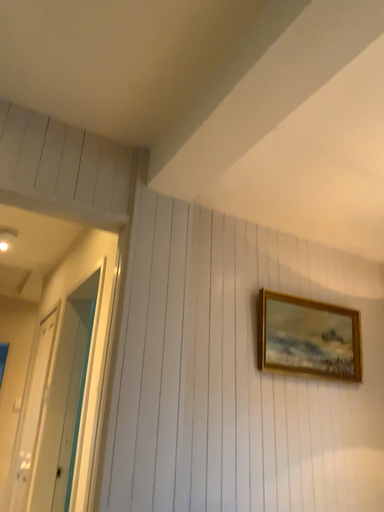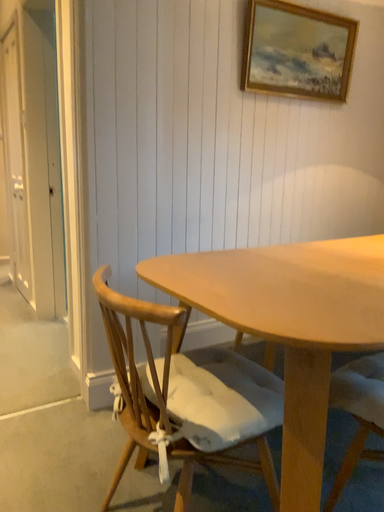
Question: How did the camera likely rotate when shooting the video?

Choices:
 (A) rotated upward
 (B) rotated downward

Answer: (B)